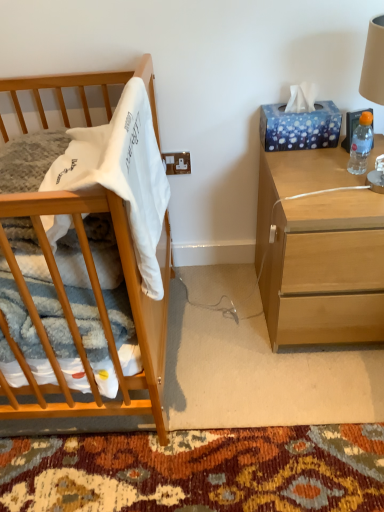
Locate an element on the screen. Image resolution: width=384 pixels, height=512 pixels. free location to the left of light wood nightstand at right is located at coordinates (216, 321).